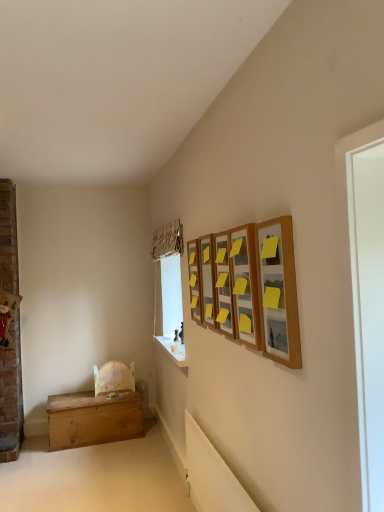
The width and height of the screenshot is (384, 512). In order to click on wooden picture frame at upper right, the first picture frame from the front in this screenshot , I will do `click(278, 292)`.

What do you see at coordinates (223, 286) in the screenshot? The image size is (384, 512). I see `wooden picture frame at upper center, acting as the 3th picture frame starting from the back` at bounding box center [223, 286].

What is the approximate width of wooden picture frame at upper right, the 2th picture frame viewed from the front?

wooden picture frame at upper right, the 2th picture frame viewed from the front, is 2.88 inches in width.

Measure the distance between wooden picture frame at upper right, which ranks as the 4th picture frame in back-to-front order, and camera.

wooden picture frame at upper right, which ranks as the 4th picture frame in back-to-front order, and camera are 5.54 feet apart from each other.

At what (x,y) coordinates should I click in order to perform the action: click on wooden picture frame at upper right, which is the 4th picture frame from front to back. Please return your answer as a coordinate pair (x, y). The height and width of the screenshot is (512, 384). Looking at the image, I should click on (207, 280).

Find the location of a particular element. Image resolution: width=384 pixels, height=512 pixels. wooden chest at lower left is located at coordinates (93, 418).

Is wooden picture frame at upper right, which is the 4th picture frame from front to back, beside wooden picture frame at upper center, marked as the 1th picture frame in a back-to-front arrangement?

No, wooden picture frame at upper right, which is the 4th picture frame from front to back, is not with wooden picture frame at upper center, marked as the 1th picture frame in a back-to-front arrangement.

Which object is positioned more to the left, wooden picture frame at upper right, which is the 4th picture frame from front to back, or wooden picture frame at upper center, the fifth picture frame positioned from the front?

From the viewer's perspective, wooden picture frame at upper center, the fifth picture frame positioned from the front, appears more on the left side.

Is wooden picture frame at upper right, which is the 4th picture frame from front to back, positioned in front of wooden picture frame at upper center, the fifth picture frame positioned from the front?

Yes, wooden picture frame at upper right, which is the 4th picture frame from front to back, is in front of wooden picture frame at upper center, the fifth picture frame positioned from the front.

Which is closer, (209, 319) or (192, 314)?

The point (209, 319) is closer.

Between point (279, 298) and point (192, 297), which one is positioned behind?

The point (192, 297) is farther from the camera.

Which of these two, wooden picture frame at upper right, the first picture frame from the front, or wooden picture frame at upper center, marked as the 1th picture frame in a back-to-front arrangement, is thinner?

wooden picture frame at upper center, marked as the 1th picture frame in a back-to-front arrangement, is thinner.

Considering the relative positions of wooden picture frame at upper right, the first picture frame from the front, and wooden picture frame at upper center, marked as the 1th picture frame in a back-to-front arrangement, in the image provided, is wooden picture frame at upper right, the first picture frame from the front, to the right of wooden picture frame at upper center, marked as the 1th picture frame in a back-to-front arrangement, from the viewer's perspective?

Indeed, wooden picture frame at upper right, the first picture frame from the front, is positioned on the right side of wooden picture frame at upper center, marked as the 1th picture frame in a back-to-front arrangement.

How different are the orientations of wooden picture frame at upper right, the first picture frame from the front, and wooden picture frame at upper center, marked as the 1th picture frame in a back-to-front arrangement, in degrees?

wooden picture frame at upper right, the first picture frame from the front, and wooden picture frame at upper center, marked as the 1th picture frame in a back-to-front arrangement, are facing 0.0424 degrees away from each other.

Which of these two, wooden picture frame at upper center, marked as the 1th picture frame in a back-to-front arrangement, or wooden chest at lower left, stands taller?

wooden picture frame at upper center, marked as the 1th picture frame in a back-to-front arrangement.

Which point is more distant from viewer, (194, 245) or (99, 422)?

Point (99, 422)

Considering the relative sizes of wooden picture frame at upper center, marked as the 1th picture frame in a back-to-front arrangement, and wooden chest at lower left in the image provided, is wooden picture frame at upper center, marked as the 1th picture frame in a back-to-front arrangement, bigger than wooden chest at lower left?

Incorrect, wooden picture frame at upper center, marked as the 1th picture frame in a back-to-front arrangement, is not larger than wooden chest at lower left.

Considering the relative positions of wooden picture frame at upper center, the fifth picture frame positioned from the front, and wooden chest at lower left in the image provided, is wooden picture frame at upper center, the fifth picture frame positioned from the front, to the right of wooden chest at lower left from the viewer's perspective?

Yes.

Between wooden picture frame at upper right, the first picture frame from the front, and wooden picture frame at upper right, which ranks as the 4th picture frame in back-to-front order, which one appears on the right side from the viewer's perspective?

wooden picture frame at upper right, the first picture frame from the front.

Is point (256, 241) closer or farther from the camera than point (239, 236)?

Point (256, 241) is positioned closer to the camera compared to point (239, 236).

Is there a large distance between wooden picture frame at upper right, the 2th picture frame viewed from the front, and wooden picture frame at upper right, the 5th picture frame positioned from the back?

wooden picture frame at upper right, the 2th picture frame viewed from the front, is near wooden picture frame at upper right, the 5th picture frame positioned from the back, not far away.

Is wooden picture frame at upper right, the 2th picture frame viewed from the front, surrounding wooden picture frame at upper right, the first picture frame from the front?

No, wooden picture frame at upper right, the first picture frame from the front, is not inside wooden picture frame at upper right, the 2th picture frame viewed from the front.

Does point (250, 298) lie behind point (265, 269)?

Yes, it is behind point (265, 269).

From the image's perspective, is wooden picture frame at upper right, which ranks as the 4th picture frame in back-to-front order, on top of wooden picture frame at upper right, the first picture frame from the front?

No, from the image's perspective, wooden picture frame at upper right, which ranks as the 4th picture frame in back-to-front order, is not on top of wooden picture frame at upper right, the first picture frame from the front.

Is wooden chest at lower left directly adjacent to wooden picture frame at upper right, the 2th picture frame viewed from the front?

They are not placed beside each other.

In terms of size, does wooden chest at lower left appear bigger or smaller than wooden picture frame at upper right, the 2th picture frame viewed from the front?

In the image, wooden chest at lower left appears to be larger than wooden picture frame at upper right, the 2th picture frame viewed from the front.

Is wooden chest at lower left positioned beyond the bounds of wooden picture frame at upper right, which ranks as the 4th picture frame in back-to-front order?

Yes, wooden chest at lower left is outside of wooden picture frame at upper right, which ranks as the 4th picture frame in back-to-front order.

How far apart are wooden chest at lower left and wooden picture frame at upper right, which ranks as the 4th picture frame in back-to-front order?

They are 2.74 meters apart.

Can you confirm if wooden picture frame at upper center, acting as the 3th picture frame starting from the back, is shorter than wooden chest at lower left?

No.

Is point (218, 318) farther from viewer compared to point (82, 432)?

No, it is in front of (82, 432).

Is wooden picture frame at upper center, acting as the 3th picture frame starting from the back, aimed at wooden chest at lower left?

No, wooden picture frame at upper center, acting as the 3th picture frame starting from the back, does not turn towards wooden chest at lower left.

Between wooden picture frame at upper center, which is the third picture frame from front to back, and wooden chest at lower left, which one appears on the left side from the viewer's perspective?

wooden chest at lower left is more to the left.

In order to click on picture frame that is the 3rd object directly below the wooden picture frame at upper right, the second picture frame from the back (from a real-world perspective) in this screenshot , I will do `click(194, 280)`.

You are a GUI agent. You are given a task and a screenshot of the screen. Output one action in this format:
    pyautogui.click(x=<x>, y=<y>)
    Task: Click on the 4th picture frame behind the wooden picture frame at upper right, the 5th picture frame positioned from the back
    This screenshot has width=384, height=512.
    Given the screenshot: What is the action you would take?
    pyautogui.click(x=194, y=280)

From the image, which object appears to be nearer to wooden picture frame at upper center, marked as the 1th picture frame in a back-to-front arrangement, wooden picture frame at upper center, acting as the 3th picture frame starting from the back, or wooden chest at lower left?

wooden picture frame at upper center, acting as the 3th picture frame starting from the back, lies closer to wooden picture frame at upper center, marked as the 1th picture frame in a back-to-front arrangement, than the other object.

Which object lies further to the anchor point wooden picture frame at upper right, the first picture frame from the front, wooden picture frame at upper center, acting as the 3th picture frame starting from the back, or wooden picture frame at upper right, which ranks as the 4th picture frame in back-to-front order?

wooden picture frame at upper center, acting as the 3th picture frame starting from the back, lies further to wooden picture frame at upper right, the first picture frame from the front, than the other object.

When comparing their distances from wooden picture frame at upper center, marked as the 1th picture frame in a back-to-front arrangement, does wooden picture frame at upper right, which is the 4th picture frame from front to back, or white smooth window sill at lower center seem further?

The object further to wooden picture frame at upper center, marked as the 1th picture frame in a back-to-front arrangement, is white smooth window sill at lower center.

Considering their positions, is wooden picture frame at upper center, acting as the 3th picture frame starting from the back, positioned further to wooden chest at lower left than wooden picture frame at upper center, marked as the 1th picture frame in a back-to-front arrangement?

Based on the image, wooden picture frame at upper center, acting as the 3th picture frame starting from the back, appears to be further to wooden chest at lower left.

Estimate the real-world distances between objects in this image. Which object is closer to white smooth window sill at lower center, wooden picture frame at upper center, the fifth picture frame positioned from the front, or wooden picture frame at upper right, the second picture frame from the back?

The object closer to white smooth window sill at lower center is wooden picture frame at upper center, the fifth picture frame positioned from the front.

When comparing their distances from white smooth window sill at lower center, does wooden picture frame at upper center, the fifth picture frame positioned from the front, or wooden chest at lower left seem closer?

wooden picture frame at upper center, the fifth picture frame positioned from the front, lies closer to white smooth window sill at lower center than the other object.

Estimate the real-world distances between objects in this image. Which object is closer to white smooth window sill at lower center, wooden picture frame at upper right, the 5th picture frame positioned from the back, or wooden picture frame at upper center, marked as the 1th picture frame in a back-to-front arrangement?

wooden picture frame at upper center, marked as the 1th picture frame in a back-to-front arrangement, lies closer to white smooth window sill at lower center than the other object.

Based on their spatial positions, is wooden picture frame at upper center, which is the third picture frame from front to back, or white smooth window sill at lower center further from wooden picture frame at upper center, marked as the 1th picture frame in a back-to-front arrangement?

Based on the image, white smooth window sill at lower center appears to be further to wooden picture frame at upper center, marked as the 1th picture frame in a back-to-front arrangement.

You are a GUI agent. You are given a task and a screenshot of the screen. Output one action in this format:
    pyautogui.click(x=<x>, y=<y>)
    Task: Click on the picture frame between wooden picture frame at upper right, which is the 4th picture frame from front to back, and wooden chest at lower left, along the z-axis
    
    Given the screenshot: What is the action you would take?
    (194, 280)

Image resolution: width=384 pixels, height=512 pixels. In order to click on window sill between wooden picture frame at upper center, marked as the 1th picture frame in a back-to-front arrangement, and wooden chest at lower left vertically in this screenshot , I will do `click(171, 351)`.

Image resolution: width=384 pixels, height=512 pixels. In order to click on window sill between wooden picture frame at upper center, which is the third picture frame from front to back, and wooden chest at lower left, along the z-axis in this screenshot , I will do `click(171, 351)`.

In order to click on picture frame located between wooden picture frame at upper right, the first picture frame from the front, and wooden picture frame at upper center, which is the third picture frame from front to back, in the depth direction in this screenshot , I will do `click(245, 285)`.